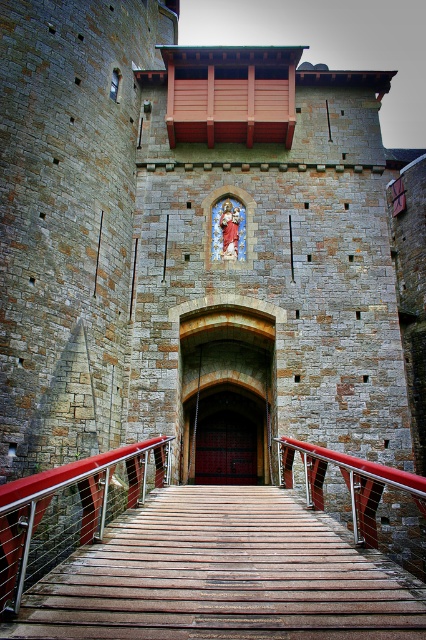
You are a tour guide leading visitors through a medieval castle. You notice a metallic red railing at center and a glass mosaic at center. Which object is taller?

The metallic red railing at center is taller than the glass mosaic at center.

You are a visitor approaching the entrance of the medieval stone structure. You notice both the metallic red railing at center and the wooden textured rail at center. Which one is positioned lower in relation to the other?

The metallic red railing at center is located below the wooden textured rail at center, meaning it is positioned lower.